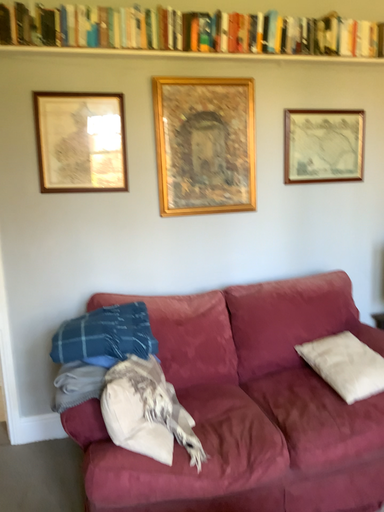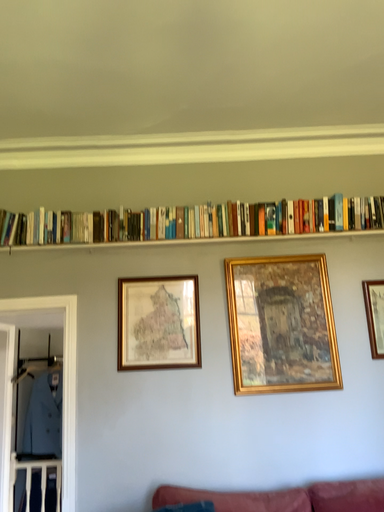
Question: How did the camera likely rotate when shooting the video?

Choices:
 (A) rotated downward
 (B) rotated upward

Answer: (B)